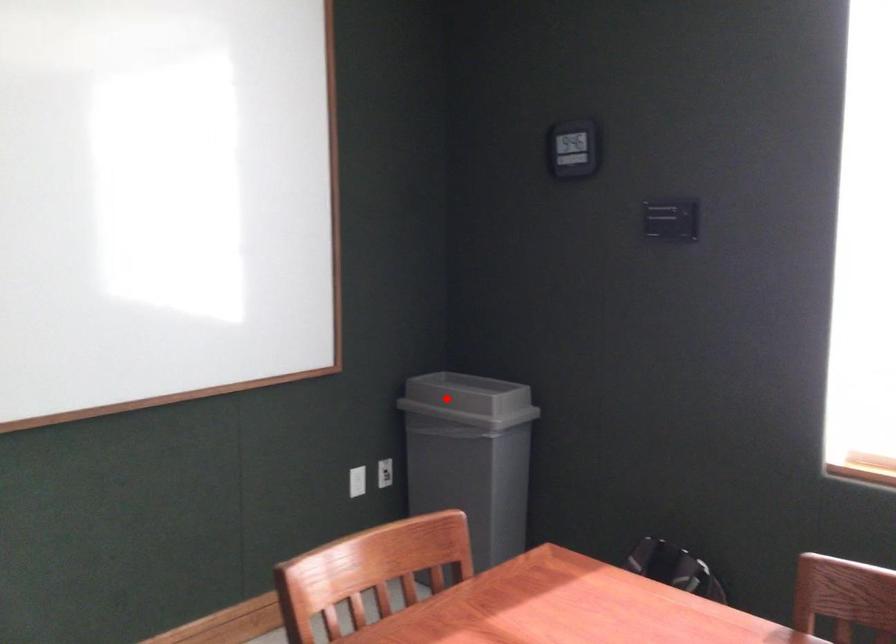
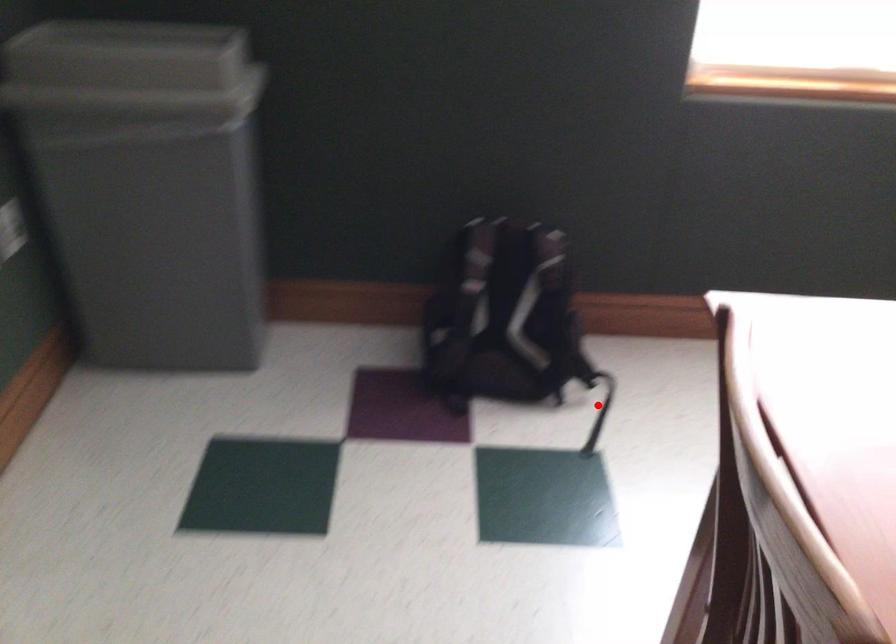
I am providing you with two images of the same scene from different viewpoints. A red point is marked on the first image and another point is marked on the second image. Does the point marked in image1 correspond to the same location as the one in image2?

No